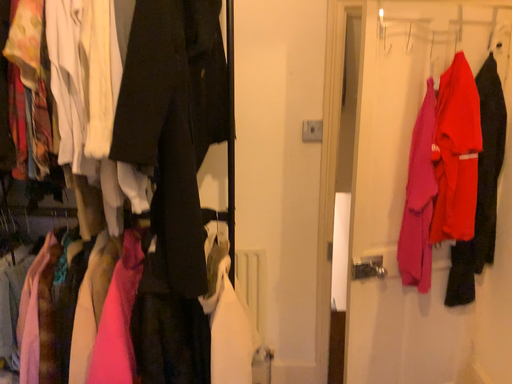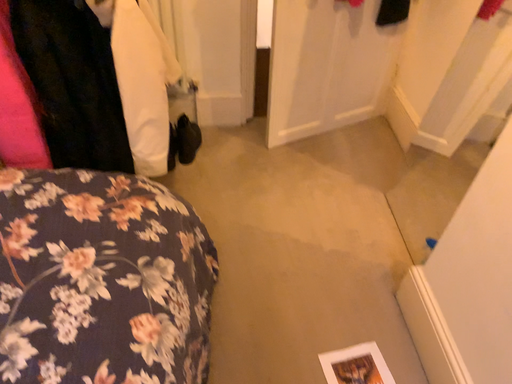
Question: How did the camera likely rotate when shooting the video?

Choices:
 (A) rotated left
 (B) rotated right

Answer: (B)